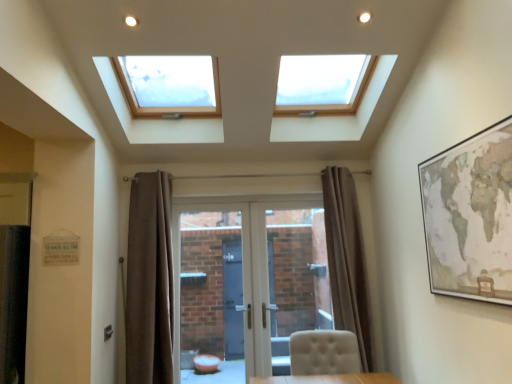
What is the approximate width of brown fabric curtain at center, positioned as the second curtain in left-to-right order?

brown fabric curtain at center, positioned as the second curtain in left-to-right order, is 12.93 inches in width.

Identify the location of white tufted chair at lower center. The image size is (512, 384). (324, 352).

In order to click on brown fabric curtain at left, the 1th curtain viewed from the left in this screenshot , I will do `click(149, 281)`.

What do you see at coordinates (149, 281) in the screenshot? The image size is (512, 384). I see `brown fabric curtain at left, the second curtain when ordered from right to left` at bounding box center [149, 281].

This screenshot has width=512, height=384. Find the location of `brown fabric curtain at center, positioned as the second curtain in left-to-right order`. brown fabric curtain at center, positioned as the second curtain in left-to-right order is located at coordinates (347, 259).

Between brown fabric curtain at center, arranged as the 1th curtain when viewed from the right, and brown fabric curtain at left, the 1th curtain viewed from the left, which one appears on the right side from the viewer's perspective?

brown fabric curtain at center, arranged as the 1th curtain when viewed from the right, is more to the right.

Considering the sizes of objects brown fabric curtain at center, positioned as the second curtain in left-to-right order, and brown fabric curtain at left, the second curtain when ordered from right to left, in the image provided, who is shorter, brown fabric curtain at center, positioned as the second curtain in left-to-right order, or brown fabric curtain at left, the second curtain when ordered from right to left,?

Standing shorter between the two is brown fabric curtain at center, positioned as the second curtain in left-to-right order.

Between brown fabric curtain at center, arranged as the 1th curtain when viewed from the right, and brown fabric curtain at left, the second curtain when ordered from right to left, which one has larger size?

brown fabric curtain at center, arranged as the 1th curtain when viewed from the right, is bigger.

From the image's perspective, is brown fabric curtain at center, arranged as the 1th curtain when viewed from the right, over brown fabric curtain at left, the 1th curtain viewed from the left?

Yes, from the image's perspective, brown fabric curtain at center, arranged as the 1th curtain when viewed from the right, is over brown fabric curtain at left, the 1th curtain viewed from the left.

Which is more to the left, brown fabric curtain at center, arranged as the 1th curtain when viewed from the right, or white glossy door at center?

From the viewer's perspective, white glossy door at center appears more on the left side.

From a real-world perspective, is brown fabric curtain at center, positioned as the second curtain in left-to-right order, located higher than white glossy door at center?

Yes, from a real-world perspective, brown fabric curtain at center, positioned as the second curtain in left-to-right order, is on top of white glossy door at center.

Is point (355, 256) positioned in front of point (210, 237)?

Yes.

Considering the relative sizes of brown fabric curtain at center, positioned as the second curtain in left-to-right order, and white glossy door at center in the image provided, is brown fabric curtain at center, positioned as the second curtain in left-to-right order, smaller than white glossy door at center?

Yes.

Can you confirm if brown fabric curtain at center, arranged as the 1th curtain when viewed from the right, is positioned to the left of white tufted chair at lower center?

No, brown fabric curtain at center, arranged as the 1th curtain when viewed from the right, is not to the left of white tufted chair at lower center.

From the picture: Is white tufted chair at lower center at the back of brown fabric curtain at center, positioned as the second curtain in left-to-right order?

No, white tufted chair at lower center is not at the back of brown fabric curtain at center, positioned as the second curtain in left-to-right order.

From a real-world perspective, is brown fabric curtain at center, positioned as the second curtain in left-to-right order, positioned above or below white tufted chair at lower center?

brown fabric curtain at center, positioned as the second curtain in left-to-right order, is situated higher than white tufted chair at lower center in the real world.

In the scene shown: Considering the sizes of brown fabric curtain at center, positioned as the second curtain in left-to-right order, and white tufted chair at lower center in the image, is brown fabric curtain at center, positioned as the second curtain in left-to-right order, bigger or smaller than white tufted chair at lower center?

Clearly, brown fabric curtain at center, positioned as the second curtain in left-to-right order, is larger in size than white tufted chair at lower center.

Find the location of `door below the brown fabric curtain at left, the second curtain when ordered from right to left (from a real-world perspective)`. door below the brown fabric curtain at left, the second curtain when ordered from right to left (from a real-world perspective) is located at coordinates (248, 284).

Measure the distance from white glossy door at center to brown fabric curtain at left, the 1th curtain viewed from the left.

white glossy door at center is 66.58 centimeters away from brown fabric curtain at left, the 1th curtain viewed from the left.

Is brown fabric curtain at left, the 1th curtain viewed from the left, located within white glossy door at center?

Definitely not — brown fabric curtain at left, the 1th curtain viewed from the left, is not inside white glossy door at center.

Is matte brown map at right taller or shorter than white tufted chair at lower center?

matte brown map at right is taller than white tufted chair at lower center.

Is matte brown map at right not near white tufted chair at lower center?

Yes, matte brown map at right and white tufted chair at lower center are located far from each other.

Can you confirm if matte brown map at right is positioned to the left of white tufted chair at lower center?

In fact, matte brown map at right is to the right of white tufted chair at lower center.

What's the angular difference between matte brown map at right and white tufted chair at lower center's facing directions?

They differ by 88.2 degrees in their facing directions.

From a real-world perspective, is brown fabric curtain at left, the 1th curtain viewed from the left, physically below matte brown map at right?

Answer: Yes, from a real-world perspective, brown fabric curtain at left, the 1th curtain viewed from the left, is below matte brown map at right.

Is brown fabric curtain at left, the second curtain when ordered from right to left, thinner than matte brown map at right?

No.

Is matte brown map at right a part of brown fabric curtain at left, the 1th curtain viewed from the left?

No, matte brown map at right is not inside brown fabric curtain at left, the 1th curtain viewed from the left.

Considering the relative positions of brown fabric curtain at left, the second curtain when ordered from right to left, and matte brown map at right in the image provided, is brown fabric curtain at left, the second curtain when ordered from right to left, to the right of matte brown map at right from the viewer's perspective?

No, brown fabric curtain at left, the second curtain when ordered from right to left, is not to the right of matte brown map at right.

Considering the sizes of objects matte brown map at right and brown fabric curtain at center, arranged as the 1th curtain when viewed from the right, in the image provided, who is thinner, matte brown map at right or brown fabric curtain at center, arranged as the 1th curtain when viewed from the right,?

matte brown map at right is thinner.

Find the location of a particular element. The height and width of the screenshot is (384, 512). picture frame positioned vertically above the brown fabric curtain at center, arranged as the 1th curtain when viewed from the right (from a real-world perspective) is located at coordinates (470, 216).

Looking at this image, considering the positions of objects matte brown map at right and brown fabric curtain at center, arranged as the 1th curtain when viewed from the right, in the image provided, who is more to the right, matte brown map at right or brown fabric curtain at center, arranged as the 1th curtain when viewed from the right,?

matte brown map at right.

The height and width of the screenshot is (384, 512). What are the coordinates of `curtain that is on the left side of brown fabric curtain at center, arranged as the 1th curtain when viewed from the right` in the screenshot? It's located at (149, 281).

At what (x,y) coordinates should I click in order to perform the action: click on door lying below the brown fabric curtain at center, arranged as the 1th curtain when viewed from the right (from the image's perspective). Please return your answer as a coordinate pair (x, y). Image resolution: width=512 pixels, height=384 pixels. Looking at the image, I should click on (248, 284).

Based on the photo, from the image, which object appears to be nearer to brown fabric curtain at left, the second curtain when ordered from right to left, brown fabric curtain at center, positioned as the second curtain in left-to-right order, or white tufted chair at lower center?

white tufted chair at lower center lies closer to brown fabric curtain at left, the second curtain when ordered from right to left, than the other object.

Looking at the image, which one is located closer to brown fabric curtain at center, arranged as the 1th curtain when viewed from the right, white tufted chair at lower center or white glossy door at center?

white tufted chair at lower center.

Considering their positions, is matte brown map at right positioned further to white glossy door at center than brown fabric curtain at left, the second curtain when ordered from right to left?

Based on the image, matte brown map at right appears to be further to white glossy door at center.

From the picture: Looking at the image, which one is located closer to brown fabric curtain at center, arranged as the 1th curtain when viewed from the right, matte brown map at right or white tufted chair at lower center?

white tufted chair at lower center.

Estimate the real-world distances between objects in this image. Which object is closer to white tufted chair at lower center, brown fabric curtain at center, arranged as the 1th curtain when viewed from the right, or matte brown map at right?

Based on the image, brown fabric curtain at center, arranged as the 1th curtain when viewed from the right, appears to be nearer to white tufted chair at lower center.

Estimate the real-world distances between objects in this image. Which object is closer to matte brown map at right, brown fabric curtain at left, the second curtain when ordered from right to left, or brown fabric curtain at center, positioned as the second curtain in left-to-right order?

Based on the image, brown fabric curtain at center, positioned as the second curtain in left-to-right order, appears to be nearer to matte brown map at right.

When comparing their distances from brown fabric curtain at center, positioned as the second curtain in left-to-right order, does brown fabric curtain at left, the second curtain when ordered from right to left, or white tufted chair at lower center seem further?

Among the two, brown fabric curtain at left, the second curtain when ordered from right to left, is located further to brown fabric curtain at center, positioned as the second curtain in left-to-right order.

From the image, which object appears to be farther from brown fabric curtain at center, positioned as the second curtain in left-to-right order, matte brown map at right or white glossy door at center?

Among the two, matte brown map at right is located further to brown fabric curtain at center, positioned as the second curtain in left-to-right order.

Locate an element on the screen. chair between brown fabric curtain at left, the 1th curtain viewed from the left, and matte brown map at right, in the horizontal direction is located at coordinates (324, 352).

I want to click on chair between matte brown map at right and white glossy door at center in the front-back direction, so click(x=324, y=352).

At what (x,y) coordinates should I click in order to perform the action: click on curtain between brown fabric curtain at left, the 1th curtain viewed from the left, and matte brown map at right from left to right. Please return your answer as a coordinate pair (x, y). The height and width of the screenshot is (384, 512). Looking at the image, I should click on (347, 259).

This screenshot has height=384, width=512. In order to click on chair located between brown fabric curtain at left, the 1th curtain viewed from the left, and brown fabric curtain at center, positioned as the second curtain in left-to-right order, in the left-right direction in this screenshot , I will do `click(324, 352)`.